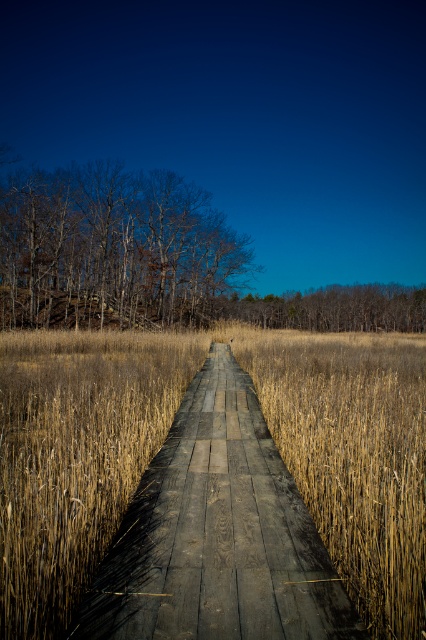
Question: From the image, what is the correct spatial relationship of dark gray wooden path at center in relation to smooth bark trees at left?

Choices:
 (A) left
 (B) right

Answer: (B)

Question: Is dark gray wooden path at center positioned before smooth bark trees at left?

Choices:
 (A) yes
 (B) no

Answer: (A)

Question: In this image, where is dark gray wooden path at center located relative to smooth bark trees at left?

Choices:
 (A) above
 (B) below

Answer: (B)

Question: Which object appears closest to the camera in this image?

Choices:
 (A) smooth bark trees at left
 (B) dark gray wooden path at center

Answer: (B)

Question: Which of the following is the farthest from the observer?

Choices:
 (A) (69, 170)
 (B) (238, 532)

Answer: (A)

Question: Which of the following is the closest to the observer?

Choices:
 (A) (187, 196)
 (B) (270, 564)

Answer: (B)